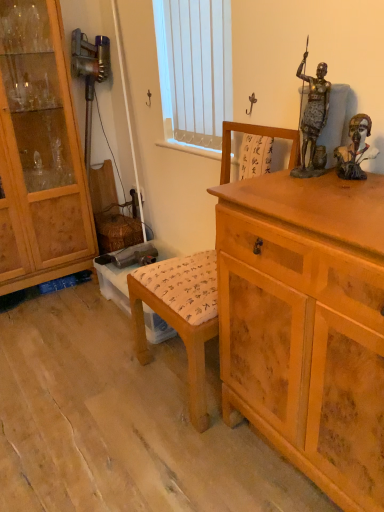
Question: Considering the relative sizes of white vertical blinds at upper center and brown wooden bust at upper right, marked as the 2th person in a left-to-right arrangement, in the image provided, is white vertical blinds at upper center taller than brown wooden bust at upper right, marked as the 2th person in a left-to-right arrangement,?

Choices:
 (A) no
 (B) yes

Answer: (B)

Question: From a real-world perspective, is white vertical blinds at upper center beneath brown wooden bust at upper right, the first person when ordered from right to left?

Choices:
 (A) no
 (B) yes

Answer: (A)

Question: From the image's perspective, is white vertical blinds at upper center beneath brown wooden bust at upper right, the first person when ordered from right to left?

Choices:
 (A) no
 (B) yes

Answer: (A)

Question: Is white vertical blinds at upper center not near brown wooden bust at upper right, marked as the 2th person in a left-to-right arrangement?

Choices:
 (A) no
 (B) yes

Answer: (A)

Question: Considering the relative sizes of white vertical blinds at upper center and brown wooden bust at upper right, the first person when ordered from right to left, in the image provided, is white vertical blinds at upper center smaller than brown wooden bust at upper right, the first person when ordered from right to left,?

Choices:
 (A) yes
 (B) no

Answer: (B)

Question: Does white vertical blinds at upper center have a greater width compared to brown wooden bust at upper right, the first person when ordered from right to left?

Choices:
 (A) no
 (B) yes

Answer: (A)

Question: Considering the relative sizes of light brown wood cabinet at left and brown wooden bust at upper right, marked as the 2th person in a left-to-right arrangement, in the image provided, is light brown wood cabinet at left taller than brown wooden bust at upper right, marked as the 2th person in a left-to-right arrangement,?

Choices:
 (A) yes
 (B) no

Answer: (A)

Question: Considering the relative sizes of light brown wood cabinet at left and brown wooden bust at upper right, the first person when ordered from right to left, in the image provided, is light brown wood cabinet at left shorter than brown wooden bust at upper right, the first person when ordered from right to left,?

Choices:
 (A) yes
 (B) no

Answer: (B)

Question: Is light brown wood cabinet at left positioned far away from brown wooden bust at upper right, marked as the 2th person in a left-to-right arrangement?

Choices:
 (A) yes
 (B) no

Answer: (A)

Question: Is light brown wood cabinet at left thinner than brown wooden bust at upper right, the first person when ordered from right to left?

Choices:
 (A) yes
 (B) no

Answer: (B)

Question: Does light brown wood cabinet at left have a smaller size compared to brown wooden bust at upper right, marked as the 2th person in a left-to-right arrangement?

Choices:
 (A) no
 (B) yes

Answer: (A)

Question: Does light brown wood cabinet at left come in front of brown wooden bust at upper right, the first person when ordered from right to left?

Choices:
 (A) no
 (B) yes

Answer: (A)

Question: Is light brown wood cabinet at left surrounded by wooden chair at center?

Choices:
 (A) no
 (B) yes

Answer: (A)